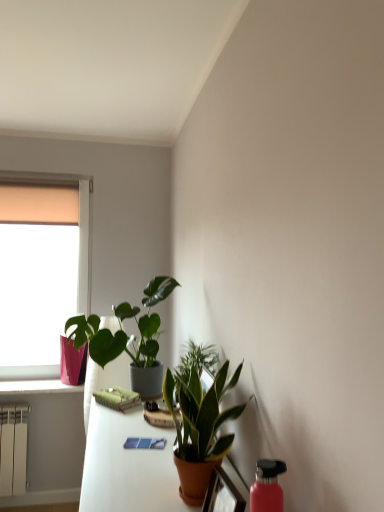
Where is `free space above terracotta ceramic table at center (from a real-world perspective)`? This screenshot has width=384, height=512. free space above terracotta ceramic table at center (from a real-world perspective) is located at coordinates (137, 452).